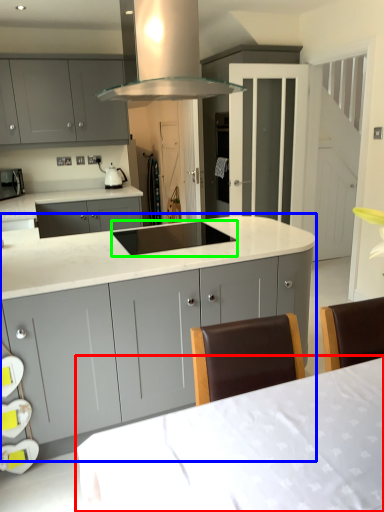
Question: Based on their relative distances, which object is farther from table (highlighted by a red box)? Choose from cabinetry (highlighted by a blue box) and sink (highlighted by a green box).

Choices:
 (A) cabinetry
 (B) sink

Answer: (B)